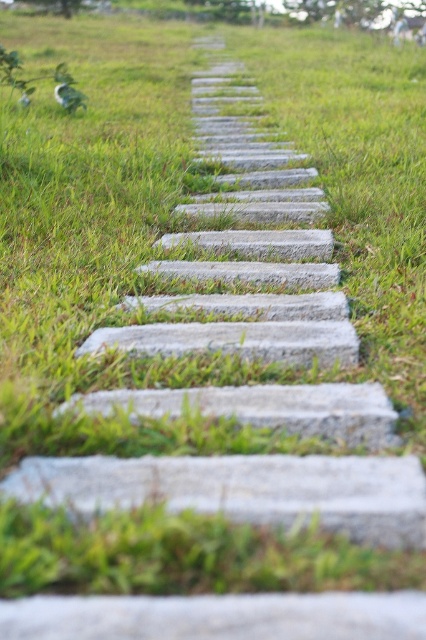
Question: Can you confirm if gray stone at center is wider than gray concrete stone at center?

Choices:
 (A) no
 (B) yes

Answer: (B)

Question: Among these objects, which one is farthest from the camera?

Choices:
 (A) gray stone at center
 (B) gray concrete stone at center

Answer: (B)

Question: Is gray stone at center thinner than gray concrete stone at center?

Choices:
 (A) no
 (B) yes

Answer: (A)

Question: In this image, where is gray stone at center located relative to gray concrete stone at center?

Choices:
 (A) above
 (B) below

Answer: (B)

Question: Which point is closer to the camera taking this photo?

Choices:
 (A) (143, 461)
 (B) (175, 410)

Answer: (A)

Question: Among these points, which one is farthest from the camera?

Choices:
 (A) (316, 390)
 (B) (85, 476)

Answer: (A)